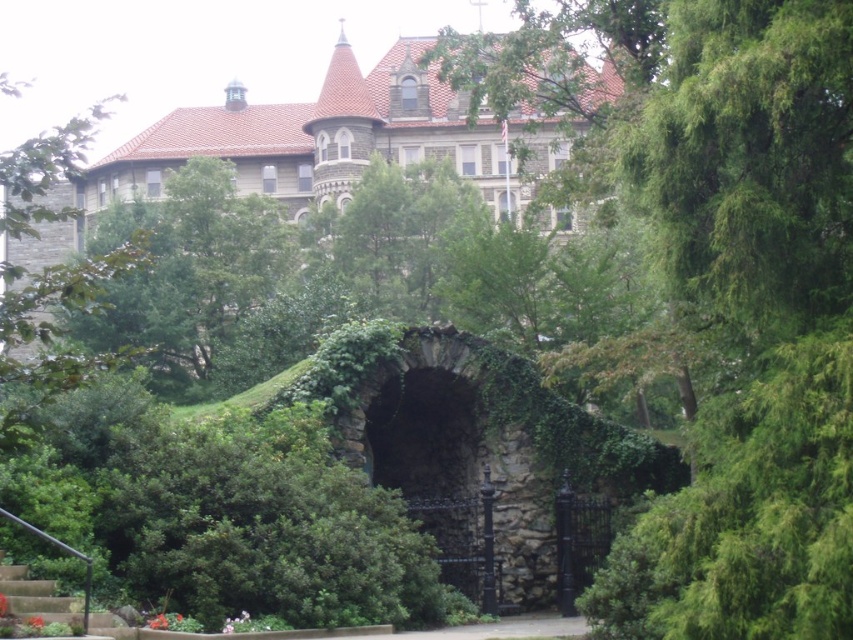
You are planning to take a photo of the green leafy tree at center and the concrete stairs at lower left. Which object should you focus on first if you want to capture both in a single frame without moving the camera?

The green leafy tree at center is wider than the concrete stairs at lower left, so you should focus on the green leafy tree at center first to ensure it fits within the frame.

You are standing at the entrance of the garden and see two points marked in the scene. The first point is at coordinates point (840, 449) and the second is at point (80, 602). Which point is closer to your current position?

Point (840, 449) is in front of point (80, 602), so the first point is closer to your current position.

You are a landscape architect designing a walking path that must pass between the green leafy tree at center and the rustic stone archway at center. What is the minimum width required for the path to ensure there is enough space between them?

The minimum width required for the path between the green leafy tree at center and the rustic stone archway at center should be at least 10.77 meters to accommodate the existing distance between them.